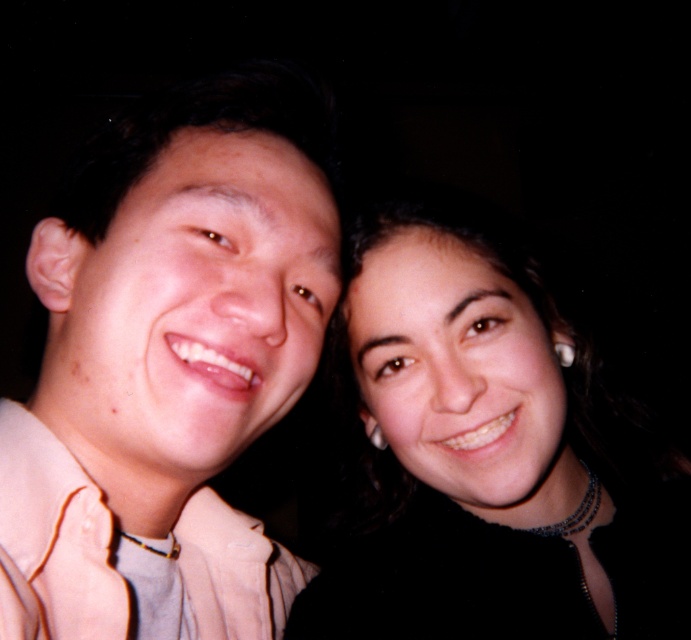
Which is in front, point (104, 212) or point (359, 218)?

Point (104, 212) is in front.

Is light beige shirt at left bigger than smooth black hair at center?

No.

Who is more forward, (146, 172) or (475, 440)?

Point (146, 172) is more forward.

This screenshot has width=691, height=640. What are the coordinates of `light beige shirt at left` in the screenshot? It's located at (169, 364).